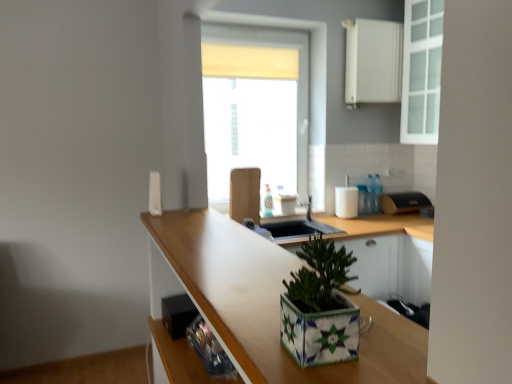
What do you see at coordinates (178, 314) in the screenshot?
I see `black plastic speaker at lower left, placed as the first appliance when sorted from front to back` at bounding box center [178, 314].

Where is `black plastic speaker at lower left, which is the first appliance in bottom-to-top order`? This screenshot has height=384, width=512. black plastic speaker at lower left, which is the first appliance in bottom-to-top order is located at coordinates (178, 314).

The image size is (512, 384). What do you see at coordinates (266, 302) in the screenshot? I see `wooden at center` at bounding box center [266, 302].

What are the coordinates of `black textured bread bin at right, which appears as the 5th appliance when viewed from the left` in the screenshot? It's located at (404, 203).

The width and height of the screenshot is (512, 384). Identify the location of black plastic speaker at lower left, which is counted as the fourth appliance, starting from the right. (178, 314).

How much distance is there between white glass cabinet at upper right and wooden at center?

white glass cabinet at upper right and wooden at center are 2.21 meters apart from each other.

Identify the location of countertop below the white glass cabinet at upper right (from the image's perspective). (266, 302).

Considering the sizes of objects white glass cabinet at upper right and wooden at center in the image provided, who is bigger, white glass cabinet at upper right or wooden at center?

With larger size is wooden at center.

Does white glass cabinet at upper right appear on the left side of wooden at center?

No.

Measure the distance from white glass cabinet at upper right to white matte soap dispenser at upper right, the 3th appliance positioned from the left.

A distance of 35.53 inches exists between white glass cabinet at upper right and white matte soap dispenser at upper right, the 3th appliance positioned from the left.

Which is closer to the camera, [415,79] or [357,202]?

Point [415,79].

From the image's perspective, which one is positioned lower, white glass cabinet at upper right or white matte soap dispenser at upper right, positioned as the third appliance in bottom-to-top order?

white matte soap dispenser at upper right, positioned as the third appliance in bottom-to-top order, appears lower in the image.

Locate an element on the screen. countertop directly beneath the white matte soap dispenser at upper right, marked as the 4th appliance in a front-to-back arrangement (from a real-world perspective) is located at coordinates (266, 302).

Which is in front, point (339, 206) or point (170, 265)?

The point (170, 265) is closer to the camera.

From a real-world perspective, is white matte soap dispenser at upper right, positioned as the third appliance in bottom-to-top order, under wooden at center?

Incorrect, from a real-world perspective, white matte soap dispenser at upper right, positioned as the third appliance in bottom-to-top order, is higher than wooden at center.

Considering the sizes of objects white matte soap dispenser at upper right, the 3th appliance positioned from the left, and wooden at center in the image provided, who is wider, white matte soap dispenser at upper right, the 3th appliance positioned from the left, or wooden at center?

wooden at center is wider.

Which object is more forward, wooden at center or white matte soap dispenser at upper right, marked as the 3th appliance in a right-to-left arrangement?

wooden at center is closer to the camera.

Does wooden at center have a lesser width compared to white matte soap dispenser at upper right, the 3th appliance from the top?

No.

Is wooden at center far away from white matte soap dispenser at upper right, marked as the 4th appliance in a front-to-back arrangement?

Yes, wooden at center is far from white matte soap dispenser at upper right, marked as the 4th appliance in a front-to-back arrangement.

Considering the sizes of objects wooden at center and white matte soap dispenser at upper right, the 3th appliance from the top, in the image provided, who is shorter, wooden at center or white matte soap dispenser at upper right, the 3th appliance from the top,?

white matte soap dispenser at upper right, the 3th appliance from the top, is shorter.

From a real-world perspective, is white matte radiator at upper right, which is the 3th appliance from back to front, on top of translucent glass window at center?

Yes, from a real-world perspective, white matte radiator at upper right, which is the 3th appliance from back to front, is on top of translucent glass window at center.

Between white matte radiator at upper right, which is the 3th appliance from back to front, and translucent glass window at center, which one appears on the right side from the viewer's perspective?

white matte radiator at upper right, which is the 3th appliance from back to front, is more to the right.

How different are the orientations of white matte radiator at upper right, the second appliance positioned from the right, and translucent glass window at center in degrees?

2.02 degrees.

Is white matte radiator at upper right, which is the 3th appliance from back to front, far away from translucent glass window at center?

white matte radiator at upper right, which is the 3th appliance from back to front, is actually quite close to translucent glass window at center.

Who is taller, white matte radiator at upper right, which is counted as the first appliance, starting from the top, or white plastic remote at upper center, acting as the fifth appliance starting from the right?

Standing taller between the two is white matte radiator at upper right, which is counted as the first appliance, starting from the top.

Is white matte radiator at upper right, the third appliance viewed from the front, oriented away from white plastic remote at upper center, the second appliance positioned from the top?

No, white plastic remote at upper center, the second appliance positioned from the top, is not at the back of white matte radiator at upper right, the third appliance viewed from the front.

Is white matte radiator at upper right, the second appliance positioned from the right, in front of or behind white plastic remote at upper center, acting as the fifth appliance starting from the right, in the image?

white matte radiator at upper right, the second appliance positioned from the right, is behind white plastic remote at upper center, acting as the fifth appliance starting from the right.

Does white matte radiator at upper right, which is counted as the first appliance, starting from the top, contain white plastic remote at upper center, the 2th appliance viewed from the front?

No, white matte radiator at upper right, which is counted as the first appliance, starting from the top, does not contain white plastic remote at upper center, the 2th appliance viewed from the front.

Which object is wider, black plastic speaker at lower left, marked as the 5th appliance in a top-to-bottom arrangement, or wooden at center?

wooden at center.

The image size is (512, 384). In order to click on the 1st appliance positioned above the wooden at center (from a real-world perspective) in this screenshot , I will do `click(178, 314)`.

Is black plastic speaker at lower left, which is counted as the fourth appliance, starting from the right, positioned with its back to wooden at center?

Absolutely, black plastic speaker at lower left, which is counted as the fourth appliance, starting from the right, is directed away from wooden at center.

Which of these two, black plastic speaker at lower left, which is counted as the fourth appliance, starting from the right, or wooden at center, stands taller?

wooden at center is taller.

Image resolution: width=512 pixels, height=384 pixels. Identify the location of countertop below the white glass cabinet at upper right (from the image's perspective). (266, 302).

This screenshot has width=512, height=384. Identify the location of cabinetry in front of the white matte soap dispenser at upper right, marked as the 3th appliance in a right-to-left arrangement. (421, 71).

Considering their positions, is white glass cabinet at upper right positioned further to white plastic remote at upper center, positioned as the 1th appliance in left-to-right order, than white matte soap dispenser at upper right, the 2th appliance positioned from the back?

white glass cabinet at upper right is further to white plastic remote at upper center, positioned as the 1th appliance in left-to-right order.

From the picture: From the image, which object appears to be farther from white matte radiator at upper right, the third appliance viewed from the front, black textured bread bin at right, positioned as the 1th appliance in right-to-left order, or white plastic remote at upper center, the second appliance positioned from the top?

white plastic remote at upper center, the second appliance positioned from the top, lies further to white matte radiator at upper right, the third appliance viewed from the front, than the other object.

Which object lies nearer to the anchor point white glass cabinet at upper right, black textured bread bin at right, the 2th appliance when ordered from bottom to top, or translucent glass window at center?

black textured bread bin at right, the 2th appliance when ordered from bottom to top, is positioned closer to the anchor white glass cabinet at upper right.

Based on their spatial positions, is black plastic speaker at lower left, marked as the 5th appliance in a top-to-bottom arrangement, or white plastic remote at upper center, positioned as the 1th appliance in left-to-right order, closer to white matte radiator at upper right, which is counted as the first appliance, starting from the top?

Among the two, white plastic remote at upper center, positioned as the 1th appliance in left-to-right order, is located nearer to white matte radiator at upper right, which is counted as the first appliance, starting from the top.

Looking at the image, which one is located closer to translucent glass window at center, white matte soap dispenser at upper right, positioned as the third appliance in bottom-to-top order, or white matte radiator at upper right, the second appliance positioned from the right?

Among the two, white matte radiator at upper right, the second appliance positioned from the right, is located nearer to translucent glass window at center.

Which object lies nearer to the anchor point white matte radiator at upper right, the third appliance viewed from the front, black plastic speaker at lower left, positioned as the second appliance in left-to-right order, or wooden at center?

wooden at center is positioned closer to the anchor white matte radiator at upper right, the third appliance viewed from the front.

Based on their spatial positions, is white matte soap dispenser at upper right, positioned as the third appliance in bottom-to-top order, or wooden at center closer to black textured bread bin at right, positioned as the 1th appliance in right-to-left order?

white matte soap dispenser at upper right, positioned as the third appliance in bottom-to-top order, is closer to black textured bread bin at right, positioned as the 1th appliance in right-to-left order.

Looking at the image, which one is located further to white matte radiator at upper right, which is the 3th appliance from back to front, white matte soap dispenser at upper right, marked as the 3th appliance in a right-to-left arrangement, or translucent glass window at center?

white matte soap dispenser at upper right, marked as the 3th appliance in a right-to-left arrangement, is positioned further to the anchor white matte radiator at upper right, which is the 3th appliance from back to front.

Find the location of a particular element. The width and height of the screenshot is (512, 384). window located between white plastic remote at upper center, marked as the fourth appliance in a bottom-to-top arrangement, and black textured bread bin at right, positioned as the 1th appliance in right-to-left order, in the left-right direction is located at coordinates (307, 87).

The height and width of the screenshot is (384, 512). In order to click on window between white plastic remote at upper center, marked as the fourth appliance in a bottom-to-top arrangement, and white matte radiator at upper right, which is the 3th appliance from back to front, from left to right in this screenshot , I will do `click(307, 87)`.

This screenshot has width=512, height=384. Identify the location of cabinetry between wooden at center and white matte radiator at upper right, which is counted as the first appliance, starting from the top, in the front-back direction. (421, 71).

What are the coordinates of `cabinetry between white matte radiator at upper right, the fifth appliance ordered from the bottom, and white matte soap dispenser at upper right, positioned as the third appliance in bottom-to-top order, from top to bottom` in the screenshot? It's located at (421, 71).